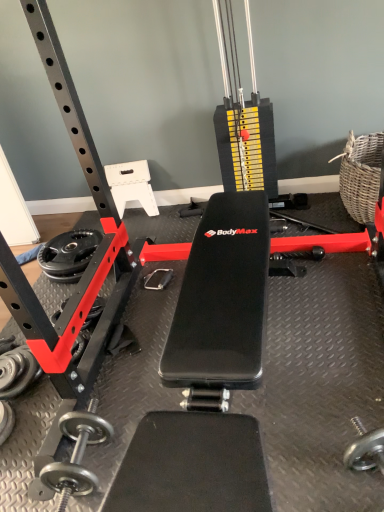
Identify the location of vacant space to the left of woven natural basket at right. (297, 221).